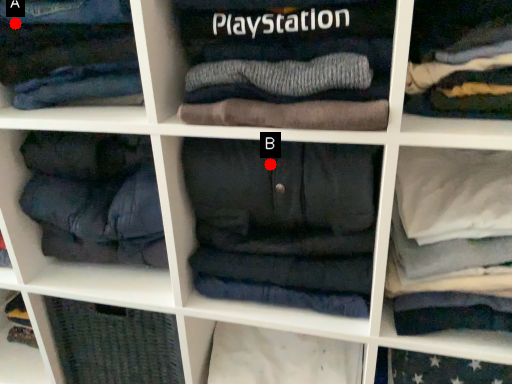
Question: Two points are circled on the image, labeled by A and B beside each circle. Which point is closer to the camera?

Choices:
 (A) A is closer
 (B) B is closer

Answer: (B)